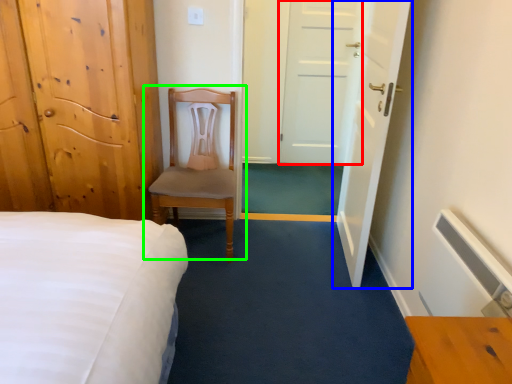
Question: Based on their relative distances, which object is farther from door (highlighted by a red box)? Choose from door (highlighted by a blue box) and chair (highlighted by a green box).

Choices:
 (A) door
 (B) chair

Answer: (B)